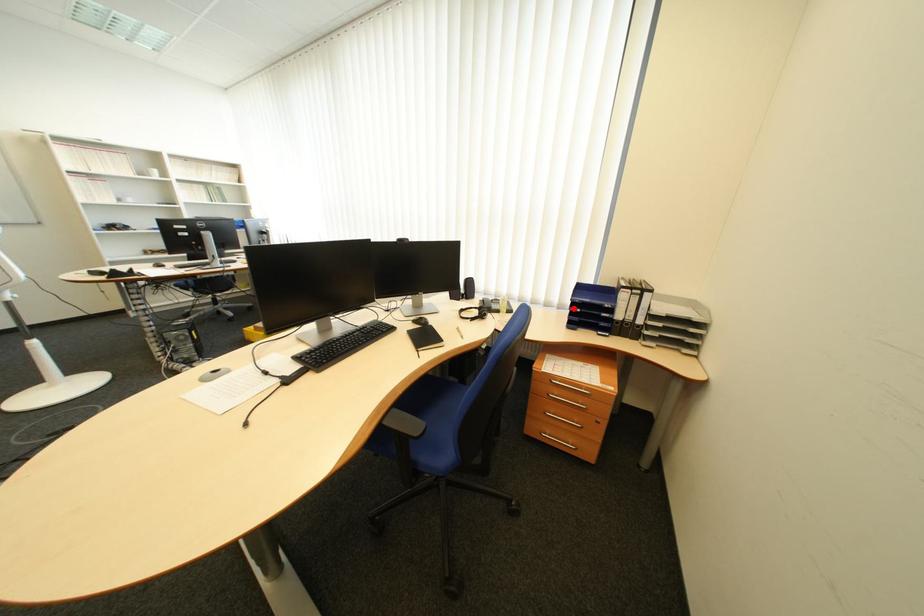
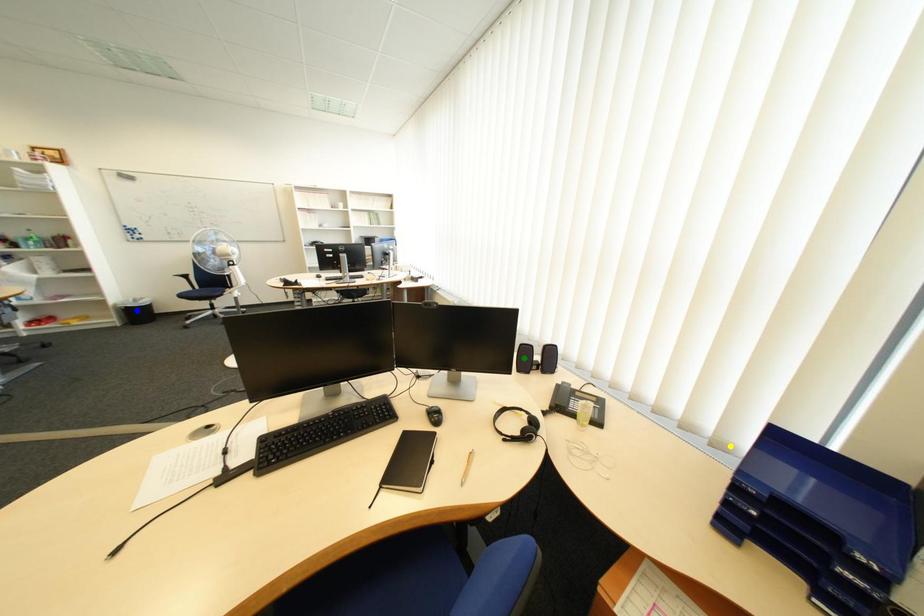
Question: I am providing you with two images of the same scene from different viewpoints. A red point is marked on the first image. You are given multiple points on the second image. Which point in image 2 represents the same 3d spot as the red point in image 1?

Choices:
 (A) green point
 (B) yellow point
 (C) blue point

Answer: (B)